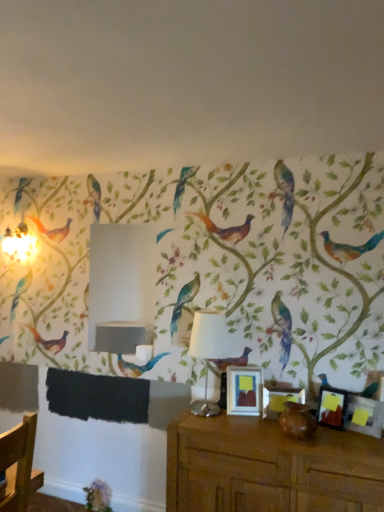
This screenshot has height=512, width=384. Identify the location of vacant region under brown matte vase at lower center (from a real-world perspective). (298, 437).